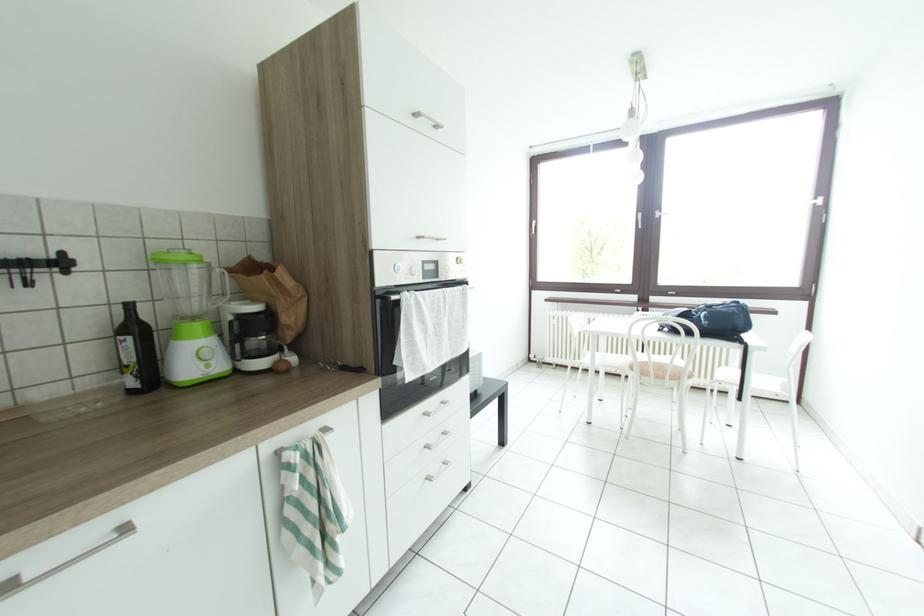
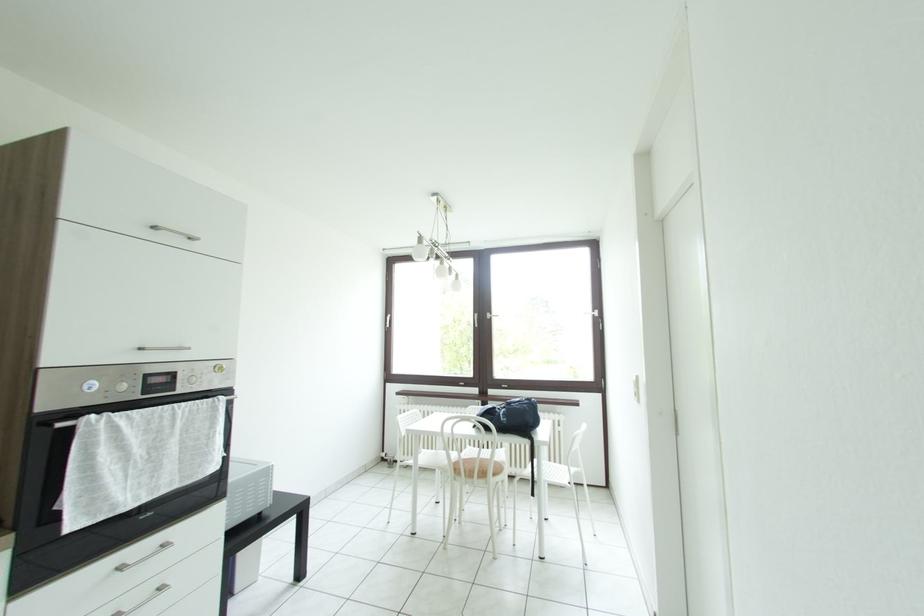
Question: The images are taken continuously from a first-person perspective. In which direction is your viewpoint rotating?

Choices:
 (A) Left
 (B) Right
 (C) Up
 (D) Down

Answer: (B)